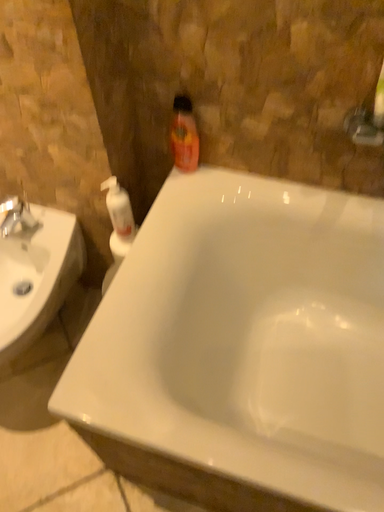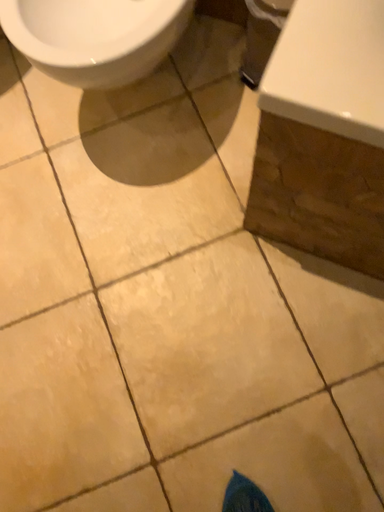
Question: Which way did the camera rotate in the video?

Choices:
 (A) rotated downward
 (B) rotated upward

Answer: (A)